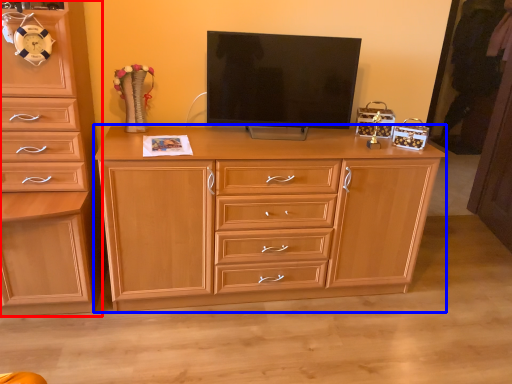
Question: Which point is closer to the camera, chest of drawers (highlighted by a red box) or chest of drawers (highlighted by a blue box)?

Choices:
 (A) chest of drawers
 (B) chest of drawers

Answer: (A)